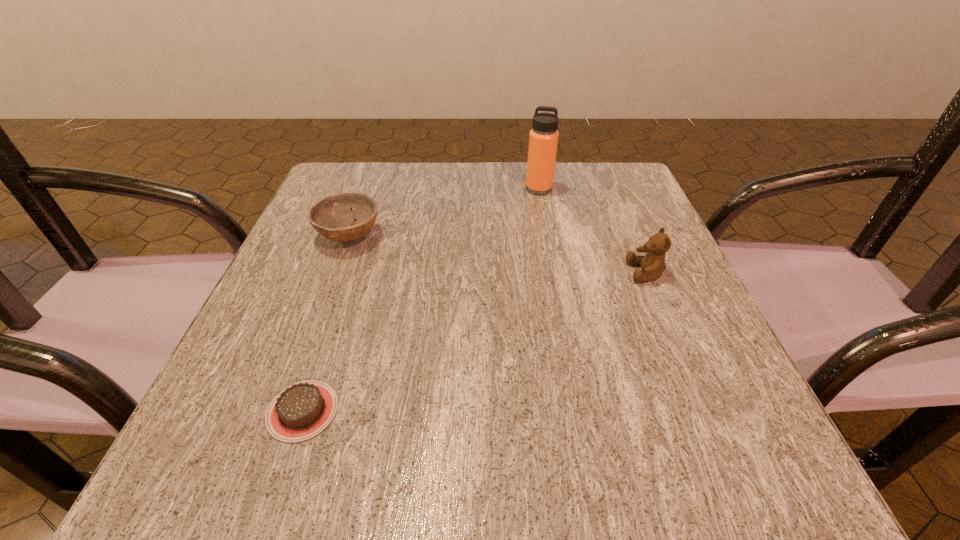
In the image, there is a desktop. What are the coordinates of `free space at the far edge` in the screenshot? It's located at (452, 173).

What are the coordinates of `vacant position at the near edge of the desktop` in the screenshot? It's located at (489, 429).

Locate an element on the screen. Image resolution: width=960 pixels, height=540 pixels. free region at the left edge is located at coordinates (331, 352).

Locate an element on the screen. The width and height of the screenshot is (960, 540). vacant space at the right edge of the desktop is located at coordinates (655, 216).

Find the location of a particular element. free space at the far left corner is located at coordinates (375, 190).

Identify the location of free region at the far right corner. Image resolution: width=960 pixels, height=540 pixels. (569, 174).

Image resolution: width=960 pixels, height=540 pixels. In the image, there is a desktop. In order to click on vacant space at the near right corner in this screenshot , I will do [x=663, y=452].

Locate an element on the screen. The image size is (960, 540). free area in between the farthest object and the teddy bear is located at coordinates (592, 231).

Locate an element on the screen. The width and height of the screenshot is (960, 540). free area in between the thermos bottle and the shortest object is located at coordinates (420, 300).

Identify the location of unoccupied position between the third nearest object and the tallest object. The image size is (960, 540). (444, 212).